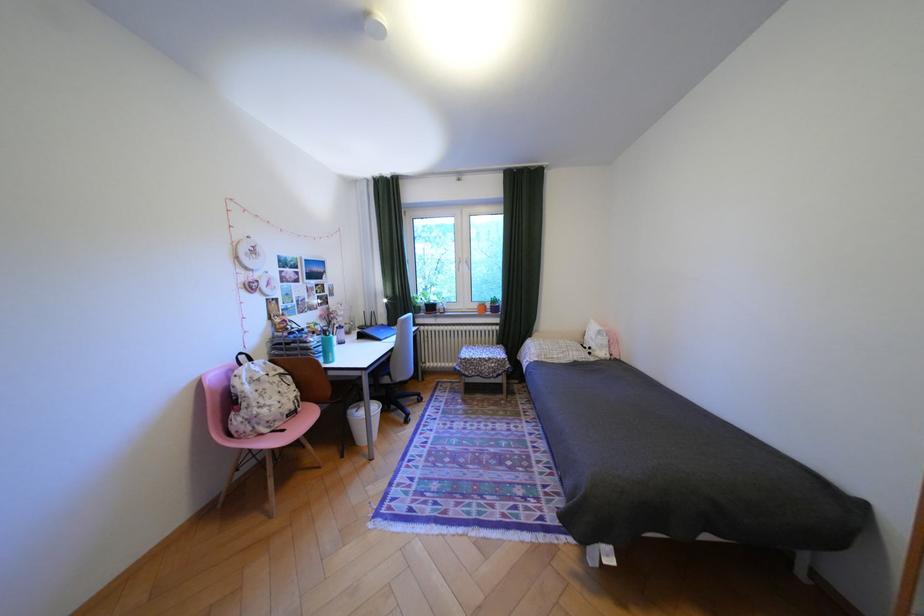
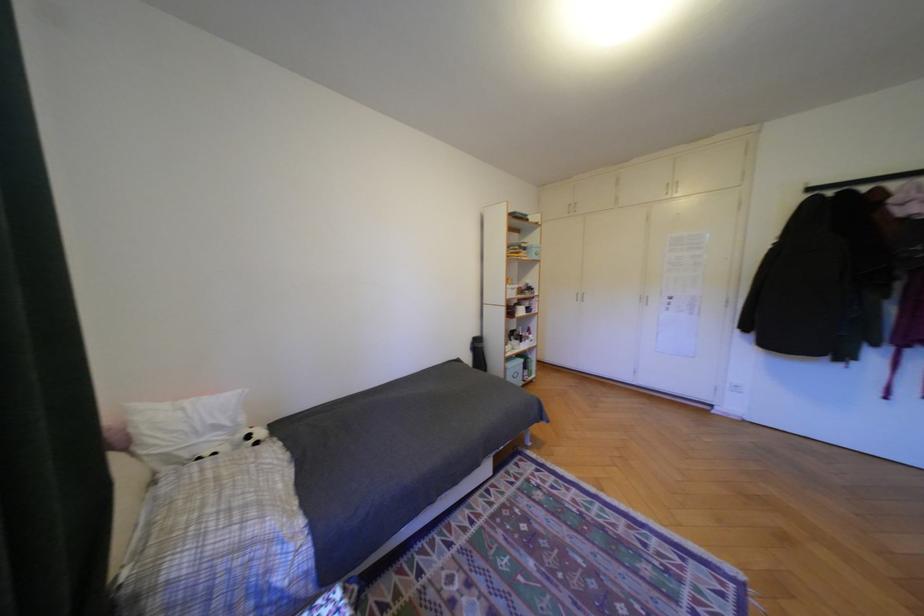
Question: I am providing you with two images of the same scene from different viewpoints. Please identify which objects are invisible in image2.

Choices:
 (A) closet door handle
 (B) soccer ball toy
 (C) light blue box
 (D) none of these

Answer: (D)